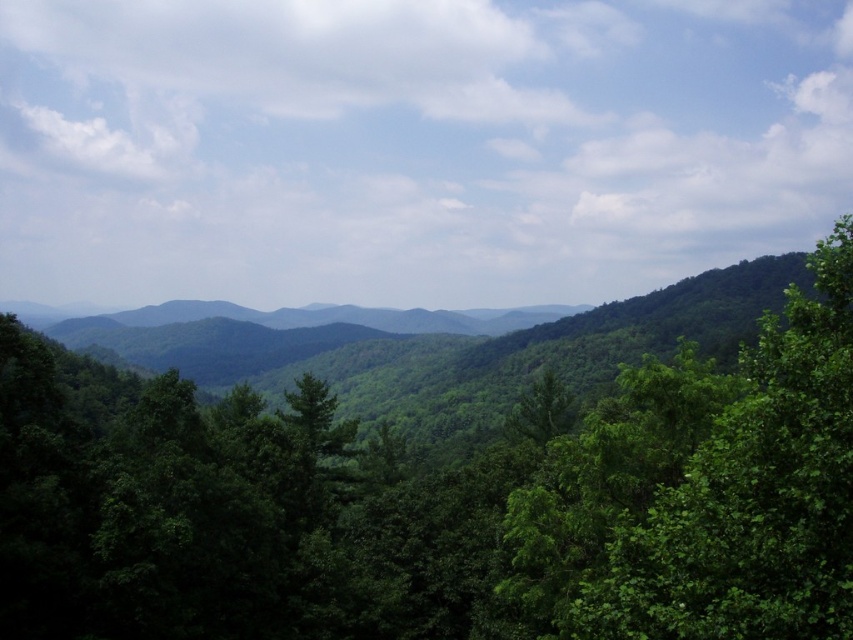
You are planning to plant a new tree between the green leafy tree at center and the green leafy tree at right. The new tree requires a minimum of 200 feet of space between it and the nearest existing tree. Is this spacing requirement met?

The green leafy tree at center and green leafy tree at right are 218.14 feet apart from each other. Since the required minimum spacing is 200 feet, the existing distance of 218.14 feet meets the requirement, so planting the new tree between them would satisfy the spacing requirement.

You are standing in the lush landscape and want to walk from the green leafy tree at center to the green leafy tree at right. Which direction should you head?

The green leafy tree at center is to the left of the green leafy tree at right, so you should head to the right to reach it.